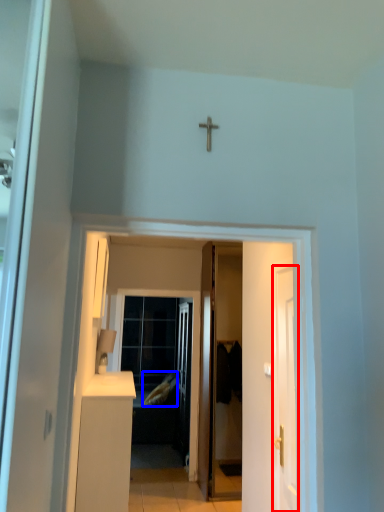
Question: Which of the following is the closest to the observer, door (highlighted by a red box) or pillow (highlighted by a blue box)?

Choices:
 (A) door
 (B) pillow

Answer: (A)